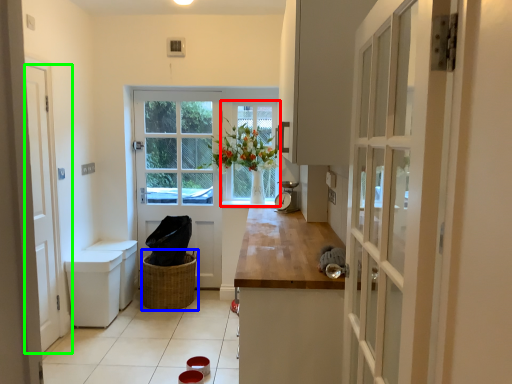
Question: Which object is positioned closest to window (highlighted by a red box)? Select from basket (highlighted by a blue box) and door (highlighted by a green box).

Choices:
 (A) basket
 (B) door

Answer: (A)